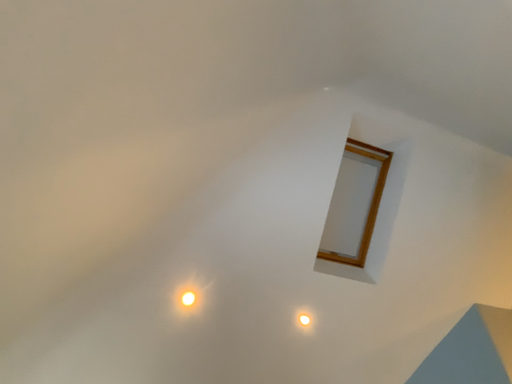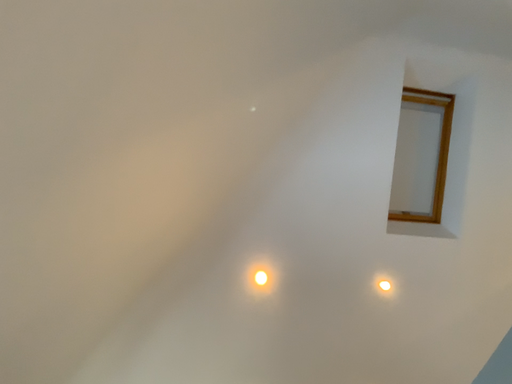
Question: How did the camera likely rotate when shooting the video?

Choices:
 (A) rotated left
 (B) rotated right

Answer: (A)